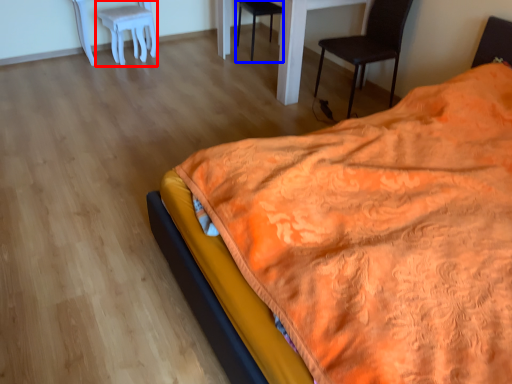
Question: Which point is closer to the camera, stool (highlighted by a red box) or chair (highlighted by a blue box)?

Choices:
 (A) stool
 (B) chair

Answer: (A)